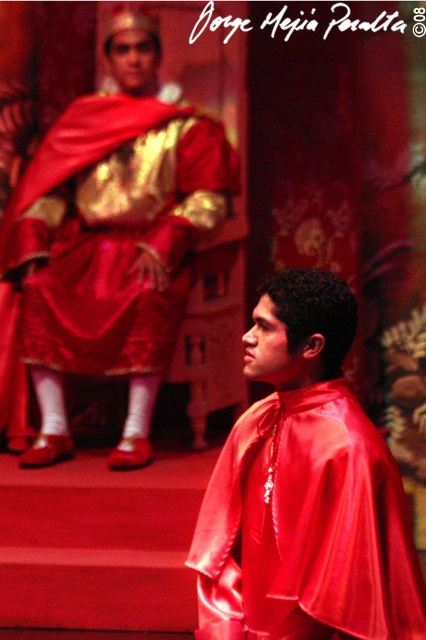
You are standing at the origin point in the image and want to move towards the two points labeled as point (143, 72) and point (388, 538). Which point should you move to first if you want to reach the one that is closer to you?

Point (388, 538) is closer to you than point (143, 72), so you should move to point (388, 538) first.

In the theatrical scene described, where exactly is the satin gold robe at upper left positioned in terms of coordinates?

The satin gold robe at upper left is positioned at the coordinates point (112, 237).

You are an event planner setting up a stage for a royal ceremony. You need to ensure that the satin gold robe at upper left and the satin red cape at center are visible to all attendees. Based on their positions, which one is higher up and might need a spotlight adjustment?

The satin gold robe at upper left is located above the satin red cape at center, so it is higher up and may require a spotlight adjustment to ensure visibility.